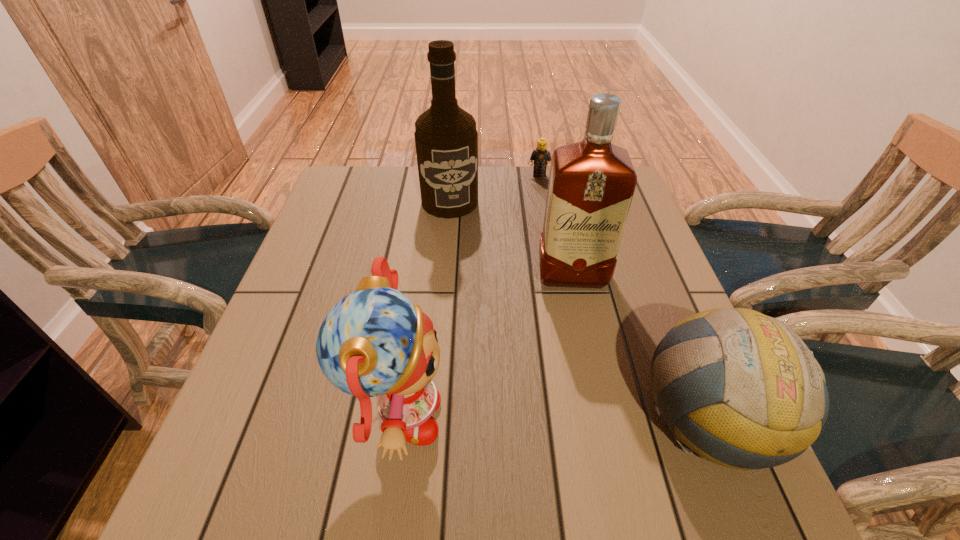
The image size is (960, 540). I want to click on vacant spot on the desktop that is between the third tallest object and the fourth tallest object and is positioned in front of the Lego, so click(x=540, y=420).

I want to click on free space on the desktop that is between the doll and the fourth tallest object and is positioned on the label of the fourth nearest object, so (510, 420).

Where is `vacant spot on the desktop that is between the third tallest object and the fourth tallest object and is positioned on the front label of the third farthest object`? This screenshot has height=540, width=960. vacant spot on the desktop that is between the third tallest object and the fourth tallest object and is positioned on the front label of the third farthest object is located at coordinates (591, 420).